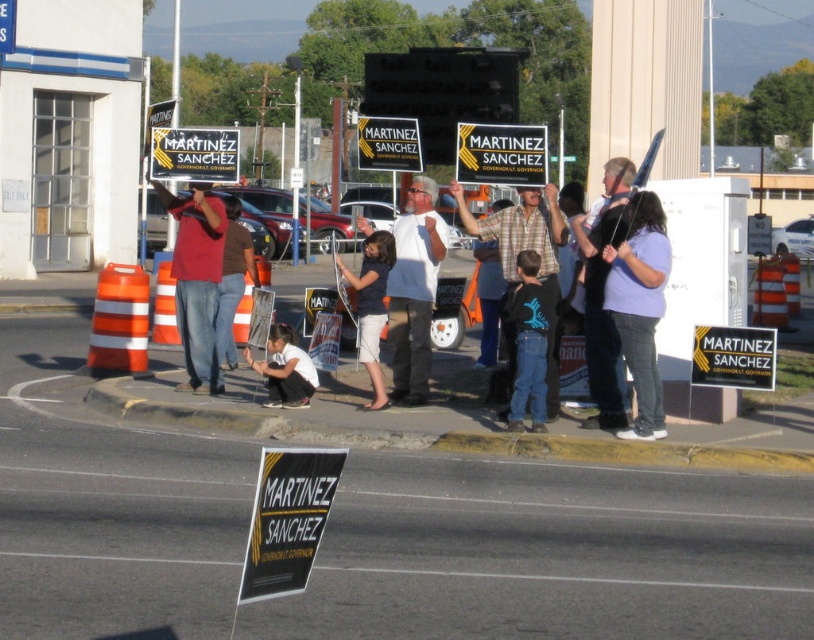
Is matte black sign at center bigger than white fabric pants at lower center?

No.

Between matte black sign at center and white fabric pants at lower center, which one has more height?

white fabric pants at lower center

Does point (478, 145) come behind point (303, 397)?

No, it is in front of (303, 397).

What are the coordinates of `matte black sign at center` in the screenshot? It's located at (501, 154).

Can you confirm if dark blue fabric shirt at center is positioned below yellow plastic sign at center?

Correct, dark blue fabric shirt at center is located below yellow plastic sign at center.

Where is `dark blue fabric shirt at center`? dark blue fabric shirt at center is located at coordinates (370, 307).

Who is taller, yellow/black plastic sign at center or dark blue fabric shirt at center?

With more height is yellow/black plastic sign at center.

Is the position of yellow/black plastic sign at center more distant than that of dark blue fabric shirt at center?

Yes, it is behind dark blue fabric shirt at center.

Is point (208, 141) less distant than point (379, 397)?

No, (208, 141) is behind (379, 397).

You are a GUI agent. You are given a task and a screenshot of the screen. Output one action in this format:
    pyautogui.click(x=<x>, y=<y>)
    Task: Click on the yellow/black plastic sign at center
    The height and width of the screenshot is (640, 814).
    Given the screenshot: What is the action you would take?
    pyautogui.click(x=195, y=154)